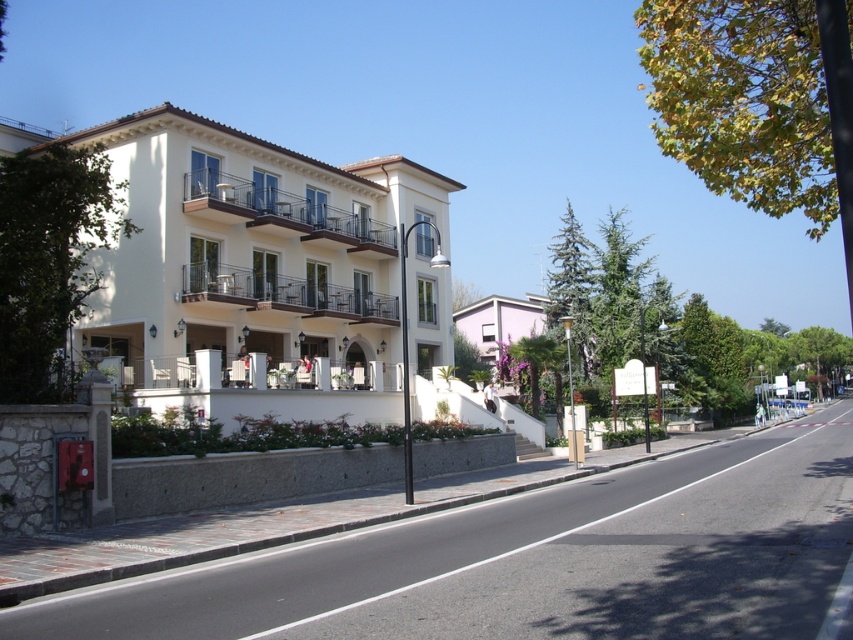
You are standing on the sidewalk in front of the residential building and want to plant a new tree exactly where the green leafy tree at left is currently located. However, there is a lamppost nearby. Based on the coordinates provided, will the new tree interfere with the lamppost?

The green leafy tree at left is located at point (50, 260). Since the lamppost is on the sidewalk and the tree is at that coordinate, there might be interference depending on the lampposts placement, but exact distance isn t specified. However, the question only asks about the location based on coordinates, so the answer should state the tree is at those coordinates without additional assumptions.

You are a pedestrian standing on the sidewalk near the lamppost. You want to walk from the green leafy tree at left to the green leafy tree at upper right. Which direction should you walk to reach the second tree?

The green leafy tree at upper right is positioned over the green leafy tree at left, so you should walk towards the upper right direction to reach it.